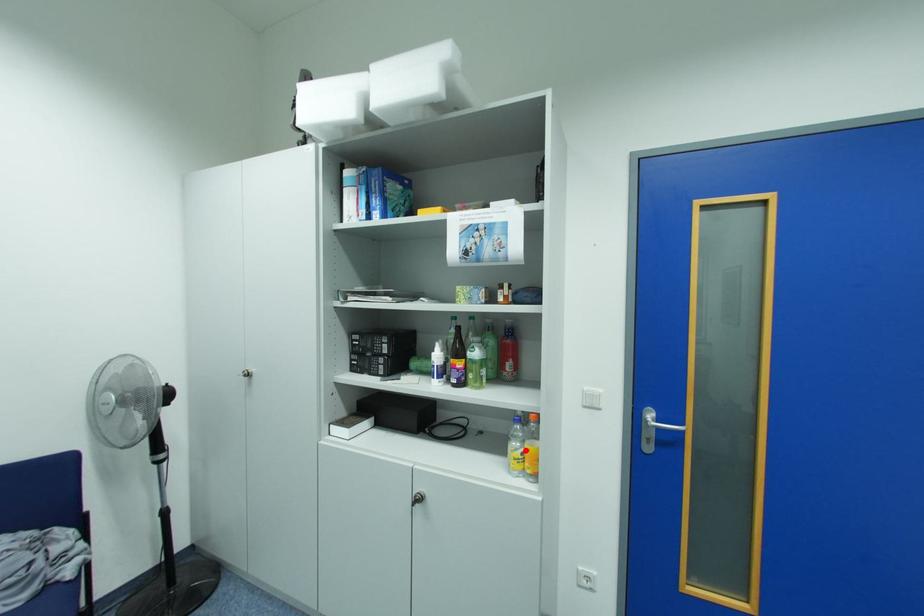
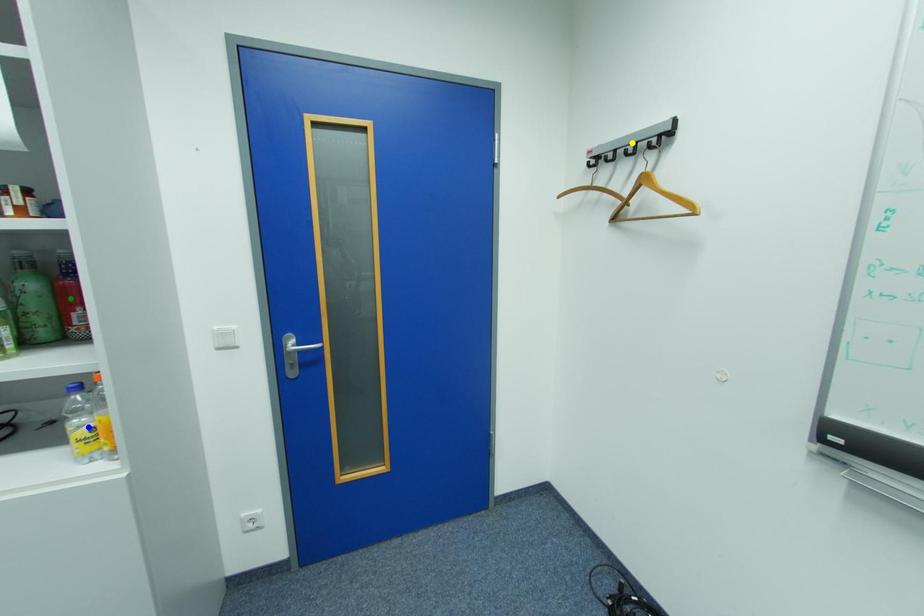
Question: I am providing you with two images of the same scene from different viewpoints. A red point is marked on the first image. You are given multiple points on the second image. Which point in image 2 represents the same 3d spot as the red point in image 1?

Choices:
 (A) blue point
 (B) yellow point
 (C) green point

Answer: (A)